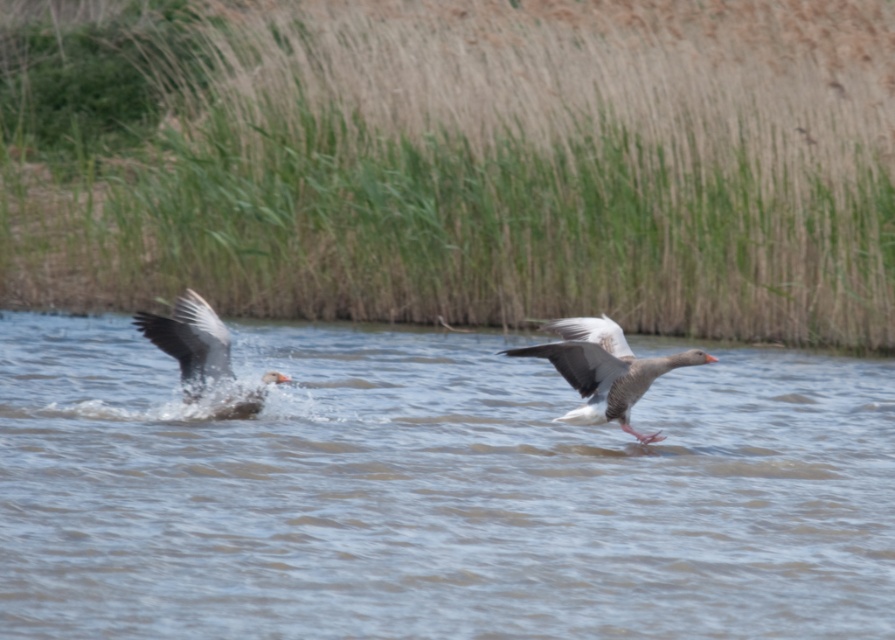
Which is above, clear water at center or gray matte duck at center?

gray matte duck at center is higher up.

Is clear water at center above gray matte duck at center?

Actually, clear water at center is below gray matte duck at center.

Which is in front, point (783, 428) or point (612, 369)?

Point (612, 369) is in front.

What are the coordinates of `clear water at center` in the screenshot? It's located at (433, 492).

Is green grass reed at upper center to the left of clear water at center from the viewer's perspective?

Correct, you'll find green grass reed at upper center to the left of clear water at center.

Between green grass reed at upper center and clear water at center, which one appears on the left side from the viewer's perspective?

green grass reed at upper center is more to the left.

The width and height of the screenshot is (895, 640). Describe the element at coordinates (457, 161) in the screenshot. I see `green grass reed at upper center` at that location.

This screenshot has width=895, height=640. I want to click on green grass reed at upper center, so click(x=457, y=161).

Between green grass reed at upper center and gray matte duck at center, which one has more height?

green grass reed at upper center

Does point (838, 120) lie behind point (599, 376)?

Yes, point (838, 120) is behind point (599, 376).

This screenshot has width=895, height=640. Find the location of `green grass reed at upper center`. green grass reed at upper center is located at coordinates (457, 161).